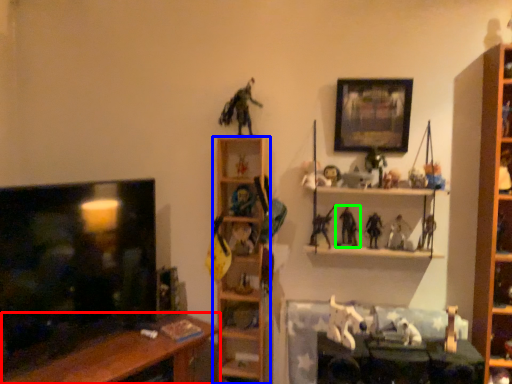
Question: Estimate the real-world distances between objects in this image. Which object is farther from table (highlighted by a red box), shelf (highlighted by a blue box) or toy (highlighted by a green box)?

Choices:
 (A) shelf
 (B) toy

Answer: (B)